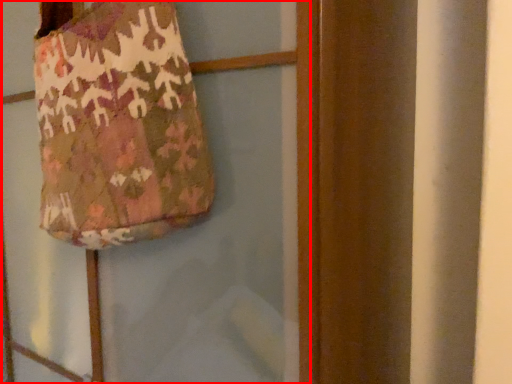
Question: From the image's perspective, where is screen door (annotated by the red box) located in relation to handbag in the image?

Choices:
 (A) below
 (B) above

Answer: (A)